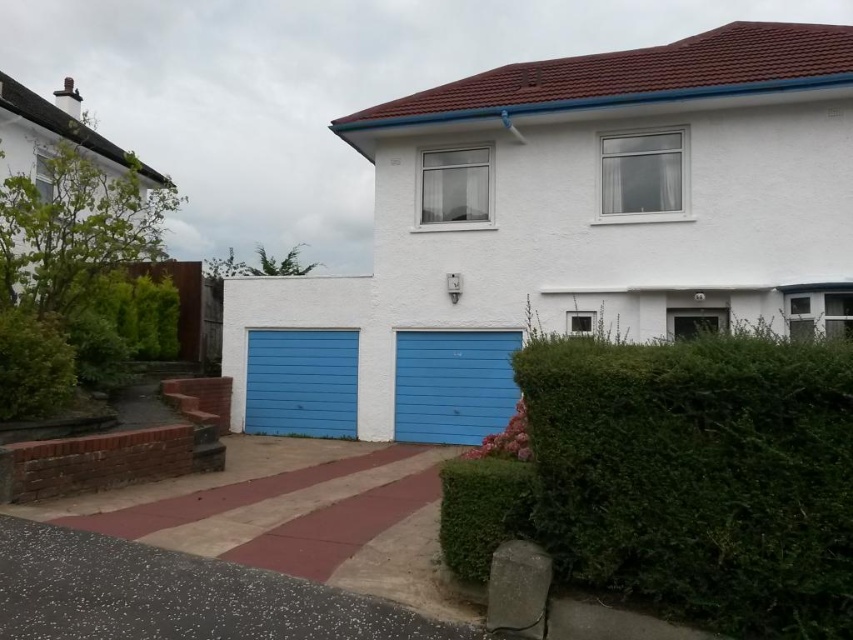
You are standing at the point with coordinates point (111, 634) and want to walk towards the house. Will you pass by point (345, 337) before reaching the house?

Since point (111, 634) is in front of point (345, 337), you will reach the house before passing by point (345, 337).

You are a delivery person approaching the house and need to place a package near the green leafy hedge at lower right without blocking the matte blue garage door at center. Is the hedge positioned in a way that allows this?

The green leafy hedge at lower right is positioned over the matte blue garage door at center, so placing the package near the hedge won t block the garage door since it is above it.